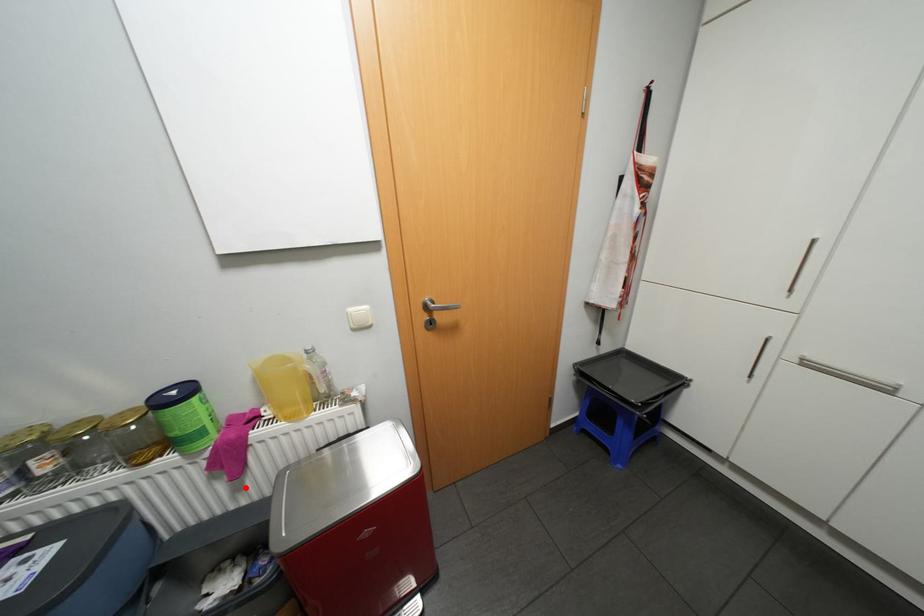
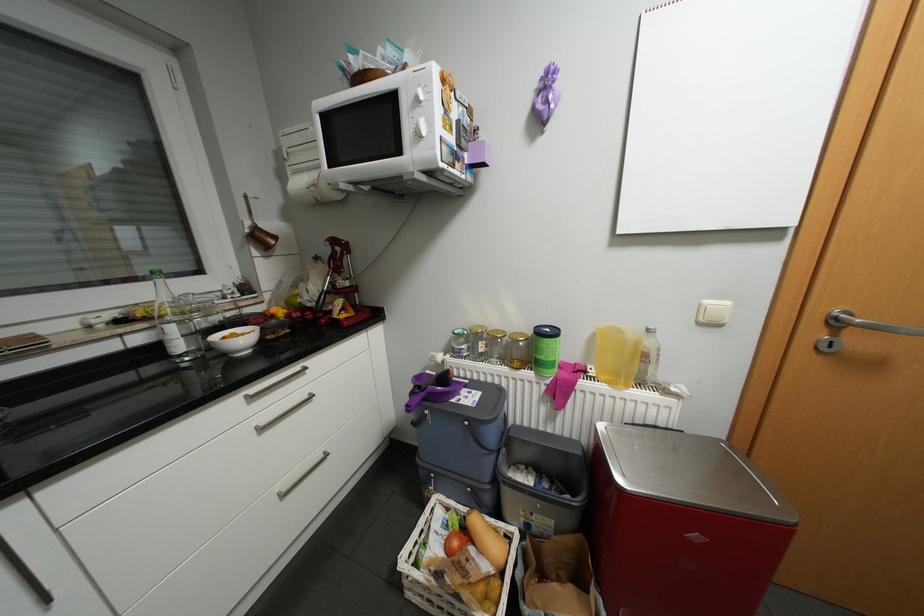
Question: A red point is marked in image1. In image2, is the corresponding 3D point closer to the camera or farther? Reply with the corresponding letter.

Choices:
 (A) The corresponding 3D point is closer.
 (B) The corresponding 3D point is farther.

Answer: (B)